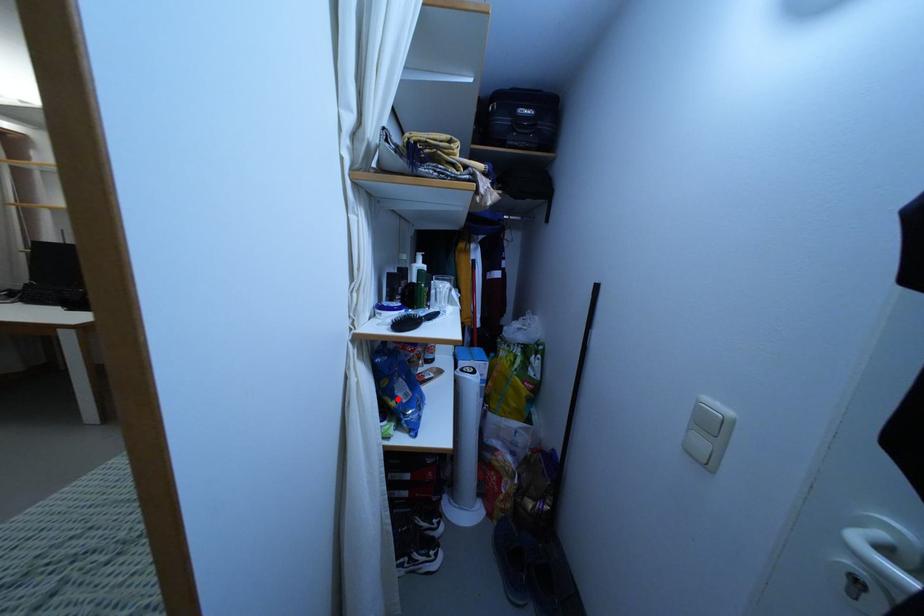
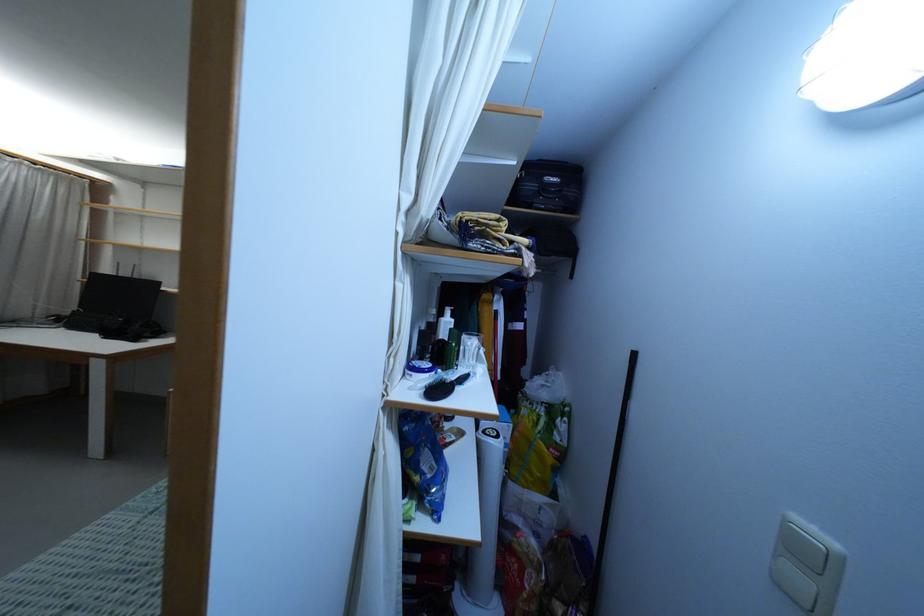
Question: I am providing you with two images of the same scene from different viewpoints. A red point is shown in image1. For the corresponding object point in image2, is it positioned nearer or farther from the camera?

Choices:
 (A) Nearer
 (B) Farther

Answer: (B)